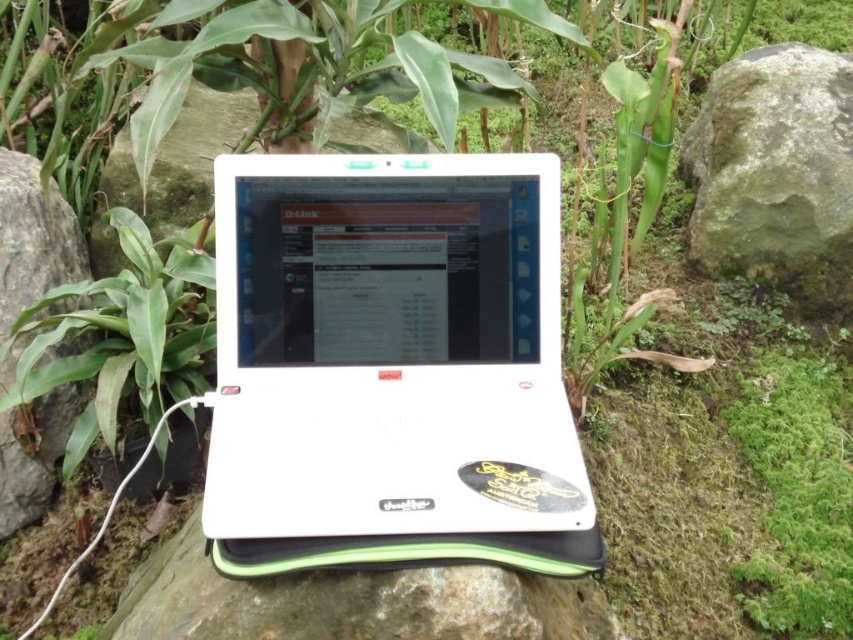
Is green mossy rock at right thinner than green leafy plant at left?

No.

Does point (762, 129) come closer to viewer compared to point (115, 310)?

No, (762, 129) is behind (115, 310).

What are the coordinates of `green mossy rock at right` in the screenshot? It's located at (775, 173).

Between green mossy rock at right and gray rock at left, which one is positioned higher?

green mossy rock at right

Can you confirm if green mossy rock at right is taller than gray rock at left?

No, green mossy rock at right is not taller than gray rock at left.

Where is `green mossy rock at right`? green mossy rock at right is located at coordinates (775, 173).

Can you confirm if white plastic laptop at center is positioned to the right of green mossy rock at right?

No, white plastic laptop at center is not to the right of green mossy rock at right.

Between point (296, 220) and point (830, 284), which one is positioned behind?

The point (830, 284) is more distant.

Is point (340, 417) positioned behind point (761, 54)?

No.

Locate an element on the screen. white plastic laptop at center is located at coordinates (389, 348).